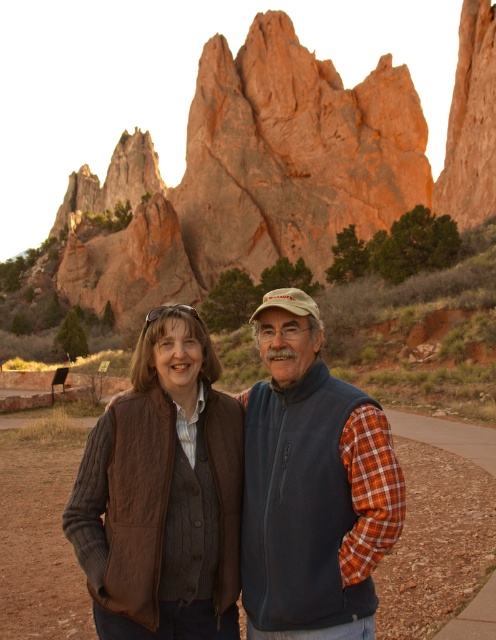
You are a photographer taking a picture of the two people in front of the Garden of the Gods. You need to ensure that both the brown leather vest at center and the blue fleece vest at center are clearly visible. Which vest should you focus on first to ensure proper focus?

The brown leather vest at center is located below the blue fleece vest at center. Since the blue fleece vest at center is higher up, you should focus on it first to ensure proper focus as it is closer to the camera.

You are a photographer trying to capture the brown leather vest at center in your shot. Based on its 2D coordinates, where should you position your camera to ensure it is centered in the frame?

To center the brown leather vest at center in your shot, position your camera so that the crosshairs align with the coordinates point 0.780 on the x axis and point 0.329 on the y axis.